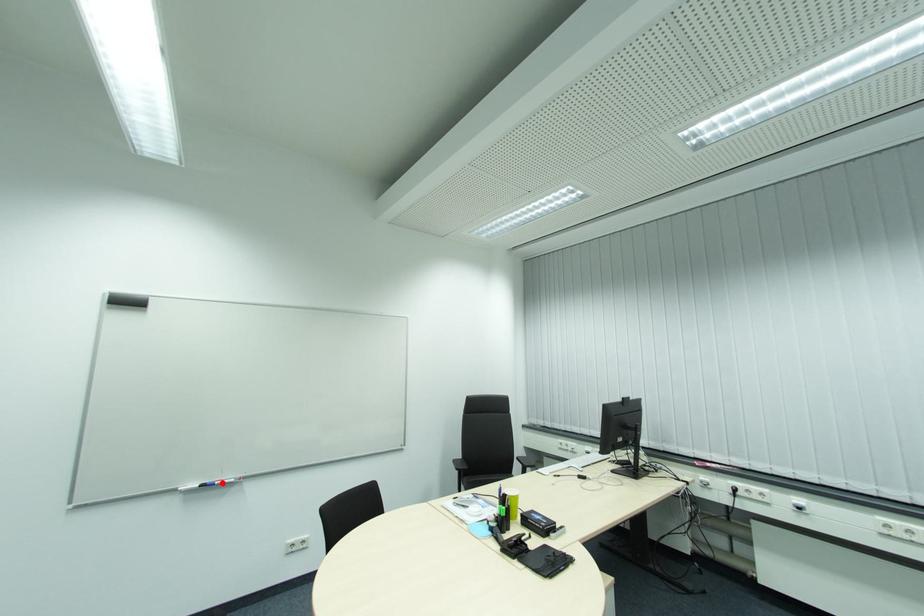
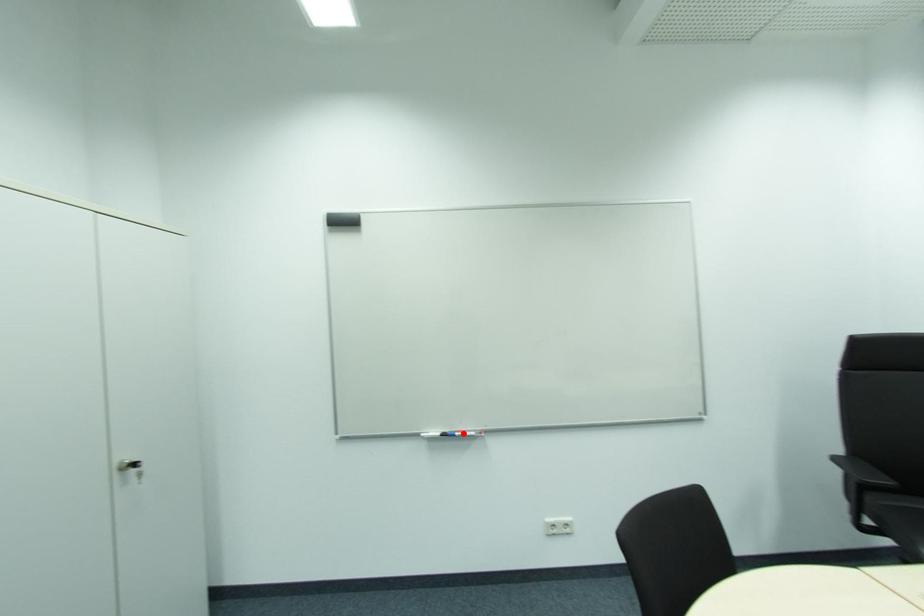
I am providing you with two images of the same scene from different viewpoints. A red point is marked on the first image and another point is marked on the second image. Do the highlighted points in image1 and image2 indicate the same real-world spot?

Yes